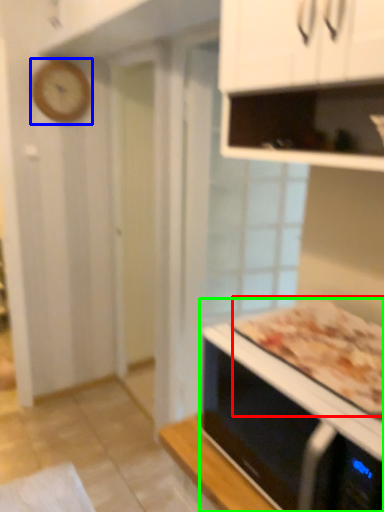
Question: Considering the real-world distances, which object is closest to pizza (highlighted by a red box)? clock (highlighted by a blue box) or microwave oven (highlighted by a green box).

Choices:
 (A) clock
 (B) microwave oven

Answer: (B)